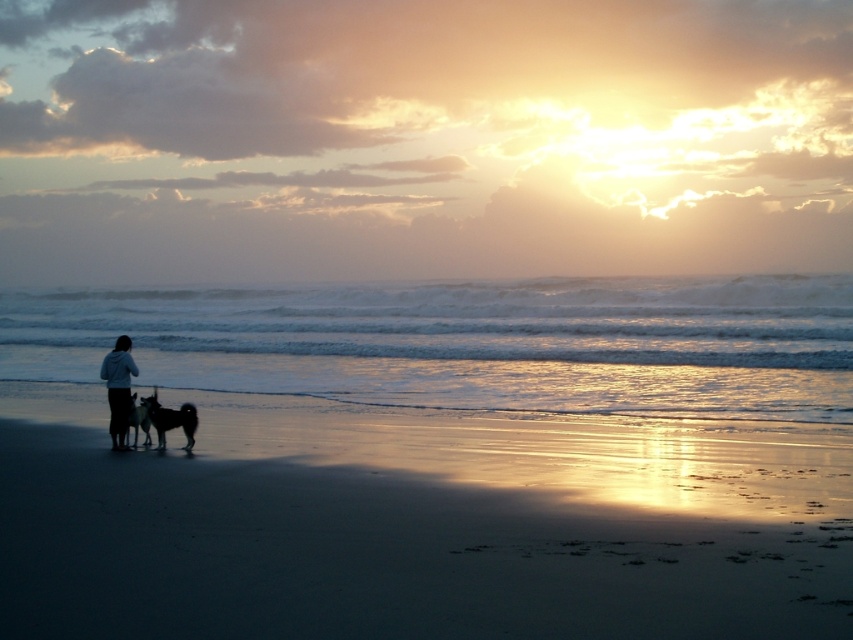
Question: Does silvery fur dog at lower left appear on the right side of shiny black dog at lower left?

Choices:
 (A) yes
 (B) no

Answer: (A)

Question: Which point is farther to the camera?

Choices:
 (A) shiny black dog at lower left
 (B) sandy beach at lower left
 (C) silvery fur dog at lower left

Answer: (A)

Question: Which point is closer to the camera?

Choices:
 (A) shiny black dog at lower left
 (B) sandy beach at lower left
 (C) light blue hoodie at left

Answer: (B)

Question: Can you confirm if sandy beach at lower left is wider than light blue hoodie at left?

Choices:
 (A) yes
 (B) no

Answer: (A)

Question: Observing the image, what is the correct spatial positioning of light blue hoodie at left in reference to shiny black dog at lower left?

Choices:
 (A) above
 (B) below

Answer: (A)

Question: Which point is farther to the camera?

Choices:
 (A) silvery fur dog at lower left
 (B) sandy beach at lower left

Answer: (A)